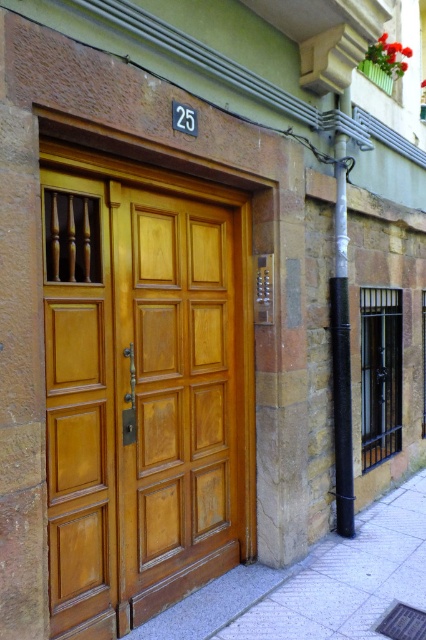
You are standing in front of the building and looking at the wooden double door with the number 25 above it. There are two points marked on the image. Which point, point (229, 344) or point (345, 369), is closer to you?

Point (229, 344) is closer to the camera than point (345, 369).

In the scene shown: You are a delivery person carrying a large package and need to park your delivery cart near the gray concrete pavement at lower right and the white painted metal pole at right. The cart requires 1 meter of space to park safely. Can you fit the cart between them?

The gray concrete pavement at lower right is 89.07 centimeters from the white painted metal pole at right. Since 89.07 centimeters is less than 1 meter, the cart cannot fit safely between them.

You are a delivery person with a 3.5 feet wide cart. You need to maneuver your cart through the space between the wooden door at center and the white painted metal pole at right. Can your cart fit through the space between them?

The wooden door at center and white painted metal pole at right are 4.65 feet apart from each other. Since your cart is 3.5 feet wide, it can fit through the space between them as the distance is greater than the cart width.